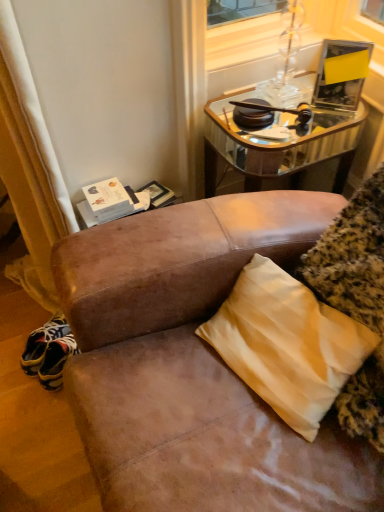
Question: Considering their positions, is yellow satin pillow at lower right located in front of or behind mirrored glass table at upper right?

Choices:
 (A) behind
 (B) front

Answer: (B)

Question: From the image's perspective, relative to mirrored glass table at upper right, is yellow satin pillow at lower right above or below?

Choices:
 (A) below
 (B) above

Answer: (A)

Question: From a real-world perspective, is yellow satin pillow at lower right above or below mirrored glass table at upper right?

Choices:
 (A) below
 (B) above

Answer: (B)

Question: Looking at the image, does mirrored glass table at upper right seem bigger or smaller compared to yellow satin pillow at lower right?

Choices:
 (A) small
 (B) big

Answer: (B)

Question: Is mirrored glass table at upper right wider or thinner than yellow satin pillow at lower right?

Choices:
 (A) wide
 (B) thin

Answer: (A)

Question: Is mirrored glass table at upper right taller or shorter than yellow satin pillow at lower right?

Choices:
 (A) short
 (B) tall

Answer: (B)

Question: Considering their positions, is mirrored glass table at upper right located in front of or behind yellow satin pillow at lower right?

Choices:
 (A) front
 (B) behind

Answer: (B)